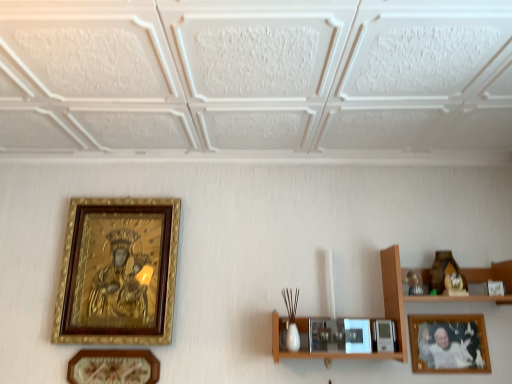
Locate an element on the screen. The width and height of the screenshot is (512, 384). wooden shelf at right is located at coordinates (403, 304).

Describe the element at coordinates (448, 344) in the screenshot. I see `wooden framed photo at lower right, the 1th picture frame viewed from the right` at that location.

Where is `matte gold picture frame at lower left, marked as the 2th picture frame in a right-to-left arrangement`? The width and height of the screenshot is (512, 384). matte gold picture frame at lower left, marked as the 2th picture frame in a right-to-left arrangement is located at coordinates (113, 367).

In the scene shown: Which is behind, goldwooden framepicture frame at left, the 1th picture frame from the left, or matte gold picture frame at lower left, the 2th picture frame in the left-to-right sequence?

goldwooden framepicture frame at left, the 1th picture frame from the left, is more distant.

Which of these two, goldwooden framepicture frame at left, the 1th picture frame from the left, or matte gold picture frame at lower left, marked as the 2th picture frame in a right-to-left arrangement, stands shorter?

matte gold picture frame at lower left, marked as the 2th picture frame in a right-to-left arrangement.

Where is `the 2nd picture frame directly above the matte gold picture frame at lower left, the 2th picture frame in the left-to-right sequence (from a real-world perspective)`? Image resolution: width=512 pixels, height=384 pixels. the 2nd picture frame directly above the matte gold picture frame at lower left, the 2th picture frame in the left-to-right sequence (from a real-world perspective) is located at coordinates (118, 272).

Consider the image. Is wooden shelf at right wider or thinner than wooden framed photo at lower right, the 1th picture frame viewed from the right?

In the image, wooden shelf at right appears to be wider than wooden framed photo at lower right, the 1th picture frame viewed from the right.

Where is `the 1st picture frame positioned below the wooden shelf at right (from the image's perspective)`? Image resolution: width=512 pixels, height=384 pixels. the 1st picture frame positioned below the wooden shelf at right (from the image's perspective) is located at coordinates (448, 344).

Considering the positions of point (390, 260) and point (470, 347), is point (390, 260) closer or farther from the camera than point (470, 347)?

Clearly, point (390, 260) is more distant from the camera than point (470, 347).

Is wooden shelf at right oriented towards wooden framed photo at lower right, which is counted as the 3th picture frame, starting from the left?

Yes, wooden shelf at right is turned towards wooden framed photo at lower right, which is counted as the 3th picture frame, starting from the left.

Find the location of a particular element. The height and width of the screenshot is (384, 512). the 1st picture frame counting from the right side of the goldwooden framepicture frame at left, the 1th picture frame from the left is located at coordinates (113, 367).

From the picture: Who is smaller, matte gold picture frame at lower left, marked as the 2th picture frame in a right-to-left arrangement, or goldwooden framepicture frame at left, the 1th picture frame from the left?

matte gold picture frame at lower left, marked as the 2th picture frame in a right-to-left arrangement.

Is matte gold picture frame at lower left, the 2th picture frame in the left-to-right sequence, looking in the opposite direction of goldwooden framepicture frame at left, the 1th picture frame from the left?

matte gold picture frame at lower left, the 2th picture frame in the left-to-right sequence, is not turned away from goldwooden framepicture frame at left, the 1th picture frame from the left.

From a real-world perspective, which is physically below, wooden framed photo at lower right, the 1th picture frame viewed from the right, or goldwooden framepicture frame at left, the 1th picture frame from the left?

From a 3D spatial view, wooden framed photo at lower right, the 1th picture frame viewed from the right, is below.

Is wooden framed photo at lower right, which is counted as the 3th picture frame, starting from the left, at the right side of goldwooden framepicture frame at left, the 1th picture frame from the left?

Yes.

Considering the relative sizes of wooden framed photo at lower right, which is counted as the 3th picture frame, starting from the left, and goldwooden framepicture frame at left, the 1th picture frame from the left, in the image provided, is wooden framed photo at lower right, which is counted as the 3th picture frame, starting from the left, shorter than goldwooden framepicture frame at left, the 1th picture frame from the left,?

Yes.

From the image's perspective, between wooden shelf at right and matte gold picture frame at lower left, the 2th picture frame in the left-to-right sequence, who is located below?

matte gold picture frame at lower left, the 2th picture frame in the left-to-right sequence, is shown below in the image.

Is wooden shelf at right wider than matte gold picture frame at lower left, marked as the 2th picture frame in a right-to-left arrangement?

Yes, wooden shelf at right is wider than matte gold picture frame at lower left, marked as the 2th picture frame in a right-to-left arrangement.

Between wooden shelf at right and matte gold picture frame at lower left, the 2th picture frame in the left-to-right sequence, which one is positioned in front?

Positioned in front is wooden shelf at right.

Is wooden shelf at right smaller than matte gold picture frame at lower left, marked as the 2th picture frame in a right-to-left arrangement?

No, wooden shelf at right is not smaller than matte gold picture frame at lower left, marked as the 2th picture frame in a right-to-left arrangement.

Does wooden framed photo at lower right, which is counted as the 3th picture frame, starting from the left, contain wooden shelf at right?

No, wooden framed photo at lower right, which is counted as the 3th picture frame, starting from the left, does not contain wooden shelf at right.

From the picture: Which object is thinner, wooden framed photo at lower right, which is counted as the 3th picture frame, starting from the left, or wooden shelf at right?

wooden framed photo at lower right, which is counted as the 3th picture frame, starting from the left.

Relative to wooden shelf at right, is wooden framed photo at lower right, the 1th picture frame viewed from the right, in front or behind?

wooden framed photo at lower right, the 1th picture frame viewed from the right, is behind wooden shelf at right.

Who is smaller, wooden shelf at right or goldwooden framepicture frame at left, the 1th picture frame from the left?

goldwooden framepicture frame at left, the 1th picture frame from the left, is smaller.

What's the angular difference between wooden shelf at right and goldwooden framepicture frame at left, marked as the third picture frame in a right-to-left arrangement,'s facing directions?

They differ by 1.55 degrees in their facing directions.

Is wooden shelf at right facing towards goldwooden framepicture frame at left, marked as the third picture frame in a right-to-left arrangement?

No, wooden shelf at right does not turn towards goldwooden framepicture frame at left, marked as the third picture frame in a right-to-left arrangement.

Consider the image. Is wooden shelf at right behind goldwooden framepicture frame at left, marked as the third picture frame in a right-to-left arrangement?

No, wooden shelf at right is closer to the viewer.

This screenshot has height=384, width=512. Identify the location of picture frame in front of the goldwooden framepicture frame at left, marked as the third picture frame in a right-to-left arrangement. (113, 367).

The height and width of the screenshot is (384, 512). What are the coordinates of `shelf lying on the left of wooden framed photo at lower right, which is counted as the 3th picture frame, starting from the left` in the screenshot? It's located at (403, 304).

Looking at the image, which one is located further to wooden shelf at right, matte gold picture frame at lower left, the 2th picture frame in the left-to-right sequence, or goldwooden framepicture frame at left, marked as the third picture frame in a right-to-left arrangement?

Among the two, matte gold picture frame at lower left, the 2th picture frame in the left-to-right sequence, is located further to wooden shelf at right.

When comparing their distances from wooden framed photo at lower right, the 1th picture frame viewed from the right, does matte gold picture frame at lower left, marked as the 2th picture frame in a right-to-left arrangement, or wooden shelf at right seem further?

matte gold picture frame at lower left, marked as the 2th picture frame in a right-to-left arrangement.

Based on their spatial positions, is matte gold picture frame at lower left, the 2th picture frame in the left-to-right sequence, or wooden framed photo at lower right, which is counted as the 3th picture frame, starting from the left, further from wooden shelf at right?

Based on the image, matte gold picture frame at lower left, the 2th picture frame in the left-to-right sequence, appears to be further to wooden shelf at right.

Which object lies further to the anchor point matte gold picture frame at lower left, the 2th picture frame in the left-to-right sequence, goldwooden framepicture frame at left, marked as the third picture frame in a right-to-left arrangement, or wooden framed photo at lower right, which is counted as the 3th picture frame, starting from the left?

The object further to matte gold picture frame at lower left, the 2th picture frame in the left-to-right sequence, is wooden framed photo at lower right, which is counted as the 3th picture frame, starting from the left.

Which object lies nearer to the anchor point goldwooden framepicture frame at left, marked as the third picture frame in a right-to-left arrangement, matte gold picture frame at lower left, marked as the 2th picture frame in a right-to-left arrangement, or wooden framed photo at lower right, the 1th picture frame viewed from the right?

matte gold picture frame at lower left, marked as the 2th picture frame in a right-to-left arrangement.

Based on their spatial positions, is wooden shelf at right or wooden framed photo at lower right, the 1th picture frame viewed from the right, closer to goldwooden framepicture frame at left, marked as the third picture frame in a right-to-left arrangement?

Among the two, wooden shelf at right is located nearer to goldwooden framepicture frame at left, marked as the third picture frame in a right-to-left arrangement.

From the image, which object appears to be farther from goldwooden framepicture frame at left, the 1th picture frame from the left, wooden framed photo at lower right, which is counted as the 3th picture frame, starting from the left, or matte gold picture frame at lower left, the 2th picture frame in the left-to-right sequence?

wooden framed photo at lower right, which is counted as the 3th picture frame, starting from the left, lies further to goldwooden framepicture frame at left, the 1th picture frame from the left, than the other object.

From the image, which object appears to be nearer to wooden framed photo at lower right, which is counted as the 3th picture frame, starting from the left, goldwooden framepicture frame at left, marked as the third picture frame in a right-to-left arrangement, or wooden shelf at right?

wooden shelf at right is positioned closer to the anchor wooden framed photo at lower right, which is counted as the 3th picture frame, starting from the left.

Locate an element on the screen. The image size is (512, 384). shelf between goldwooden framepicture frame at left, marked as the third picture frame in a right-to-left arrangement, and wooden framed photo at lower right, the 1th picture frame viewed from the right, in the horizontal direction is located at coordinates (403, 304).

This screenshot has height=384, width=512. In order to click on picture frame located between goldwooden framepicture frame at left, the 1th picture frame from the left, and wooden framed photo at lower right, the 1th picture frame viewed from the right, in the left-right direction in this screenshot , I will do `click(113, 367)`.

This screenshot has height=384, width=512. In order to click on picture frame between goldwooden framepicture frame at left, marked as the third picture frame in a right-to-left arrangement, and wooden shelf at right from left to right in this screenshot , I will do `click(113, 367)`.

Identify the location of shelf between matte gold picture frame at lower left, marked as the 2th picture frame in a right-to-left arrangement, and wooden framed photo at lower right, which is counted as the 3th picture frame, starting from the left, from left to right. (403, 304).